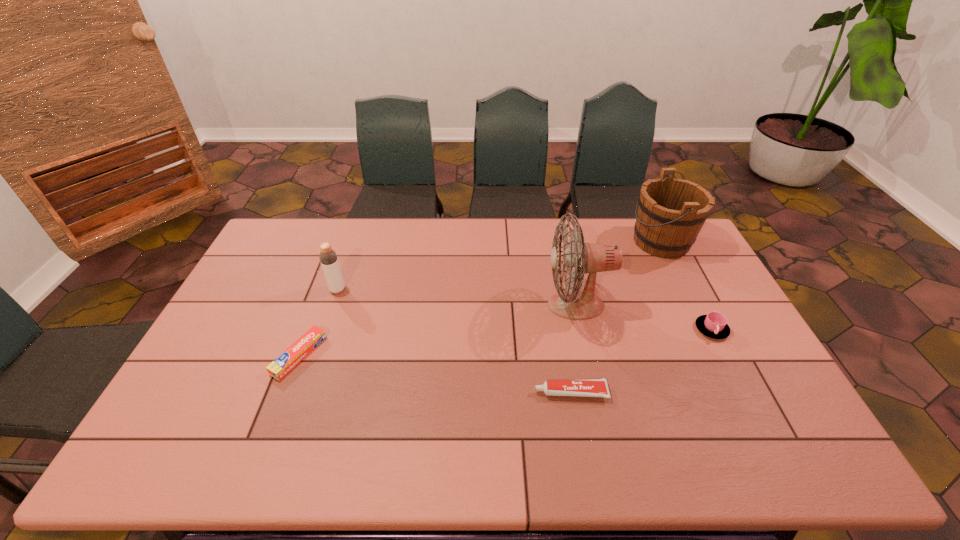
Where is `vacant space located 0.370m in front of the fan to direct airflow`? The height and width of the screenshot is (540, 960). vacant space located 0.370m in front of the fan to direct airflow is located at coordinates [428, 305].

Image resolution: width=960 pixels, height=540 pixels. In order to click on vacant position located 0.170m in front of the fan to direct airflow in this screenshot , I will do `click(492, 305)`.

The height and width of the screenshot is (540, 960). I want to click on vacant space located on the side of the second tallest object with the handle for carrying, so click(570, 242).

Image resolution: width=960 pixels, height=540 pixels. I want to click on free spot located 0.160m on the side of the second tallest object with the handle for carrying, so click(x=587, y=242).

The image size is (960, 540). Find the location of `vacant space located on the side of the second tallest object with the handle for carrying`. vacant space located on the side of the second tallest object with the handle for carrying is located at coordinates (552, 242).

At what (x,y) coordinates should I click in order to perform the action: click on free space located 0.050m on the front of the bottle. Please return your answer as a coordinate pair (x, y). This screenshot has width=960, height=540. Looking at the image, I should click on (332, 306).

Where is `free space located on the side with the handle of the cup`? The height and width of the screenshot is (540, 960). free space located on the side with the handle of the cup is located at coordinates (780, 462).

The width and height of the screenshot is (960, 540). I want to click on free space located 0.050m at the nozzle of the nearer toothpaste, so click(516, 392).

Identify the location of vacant position located 0.310m at the nozzle of the nearer toothpaste. (417, 392).

At what (x,y) coordinates should I click in order to perform the action: click on vacant space located 0.110m at the nozzle of the nearer toothpaste. Please return your answer as a coordinate pair (x, y). Looking at the image, I should click on (492, 392).